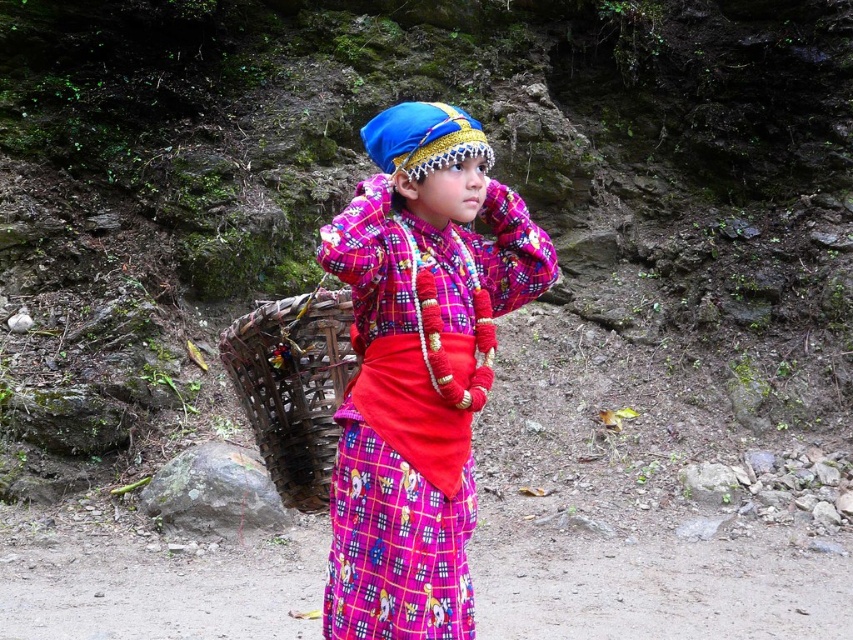
You are a photographer trying to capture the child in the image. You want to ensure the plaid fabric shirt at center and the natural wood basket at center are both clearly visible in the photo. Based on their positions, which item is closer to the top of the image?

The plaid fabric shirt at center is above the natural wood basket at center, so the plaid fabric shirt at center is closer to the top of the image.

You are a photographer trying to capture the child holding the woven basket. You want to ensure that both points, point (x=393, y=403) and point (x=271, y=348), are visible in your photo. Which point should be closer to the camera to ensure both are in frame?

Point (x=393, y=403) is in front of point (x=271, y=348), so to ensure both points are visible in the photo, the camera should be positioned so that point (x=393, y=403) is closer to the camera. This way, both points will be in frame with the foreground point visible in front and the background point still within the shot.